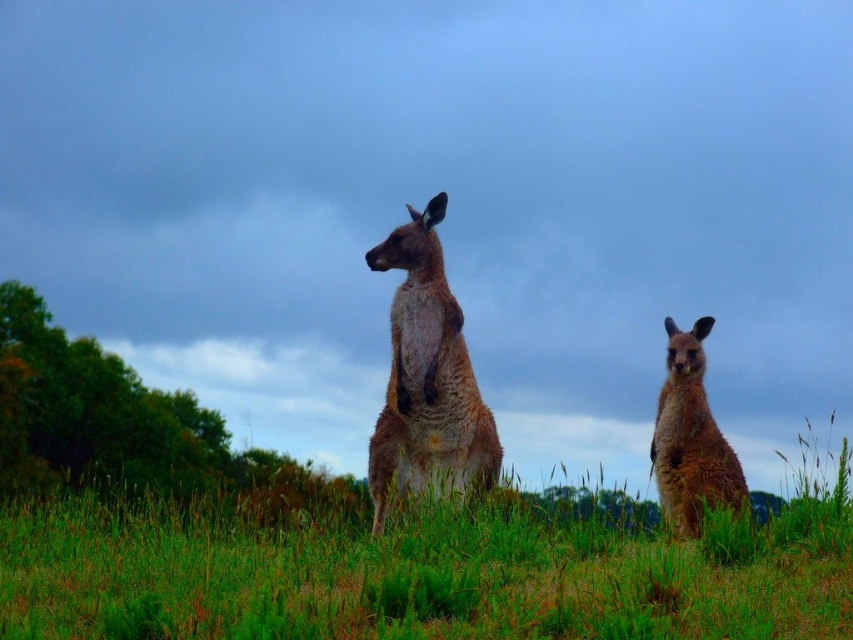
What do you see at coordinates (427, 573) in the screenshot? I see `green grassy at center` at bounding box center [427, 573].

Is point (140, 561) less distant than point (682, 353)?

Yes, point (140, 561) is in front of point (682, 353).

Describe the element at coordinates (427, 573) in the screenshot. I see `green grassy at center` at that location.

This screenshot has width=853, height=640. Find the location of `green grassy at center`. green grassy at center is located at coordinates coord(427,573).

Can you confirm if green grassy at center is bigger than furry brown kangaroo at center?

Yes, green grassy at center is bigger than furry brown kangaroo at center.

Does green grassy at center come behind furry brown kangaroo at center?

No, it is not.

Is point (514, 509) closer to viewer compared to point (405, 328)?

Yes, point (514, 509) is in front of point (405, 328).

Where is `green grassy at center`? The image size is (853, 640). green grassy at center is located at coordinates [427, 573].

Between point (448, 301) and point (685, 461), which one is positioned in front?

Point (448, 301)

Locate an element on the screen. Image resolution: width=853 pixels, height=640 pixels. furry brown kangaroo at center is located at coordinates (426, 376).